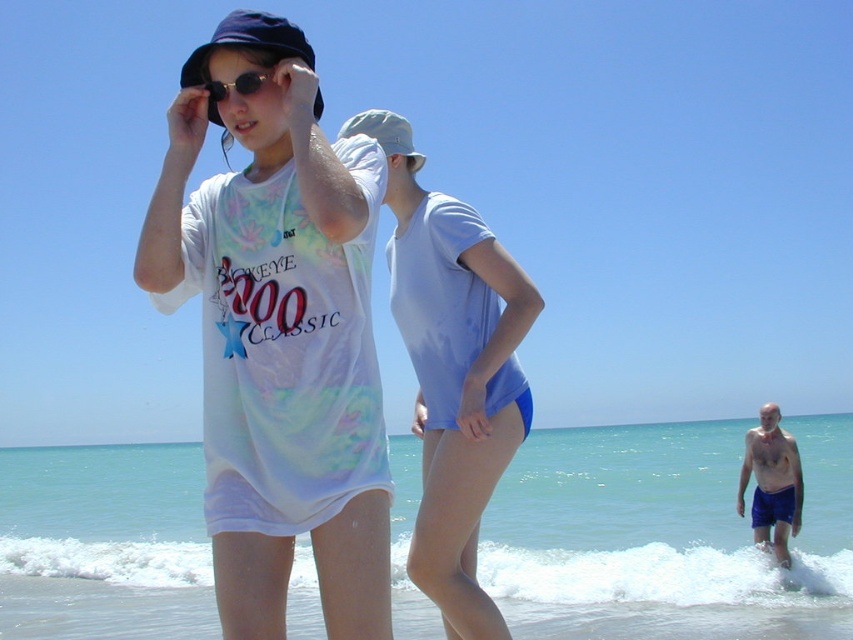
You are a photographer on the beach and want to capture a photo that includes both the light blue swimsuit at center and the matte blue baseball hat at upper left. Given that your camera has a maximum focus range of 6 feet, will you be able to include both objects in the same frame without moving closer or farther away?

The light blue swimsuit at center and the matte blue baseball hat at upper left are 6.85 feet apart from each other. Since the distance between them exceeds the camera maximum focus range of 6 feet, you will not be able to include both in the same frame without adjusting your position.

You are a photographer at the beach and want to capture both the light blue swimsuit at center and the matte blue baseball hat at upper left in the same frame. Which object should you focus on first to ensure both are in the frame?

The light blue swimsuit at center has a smaller size compared to matte blue baseball hat at upper left, so you should focus on the matte blue baseball hat at upper left first to ensure both are in the frame.